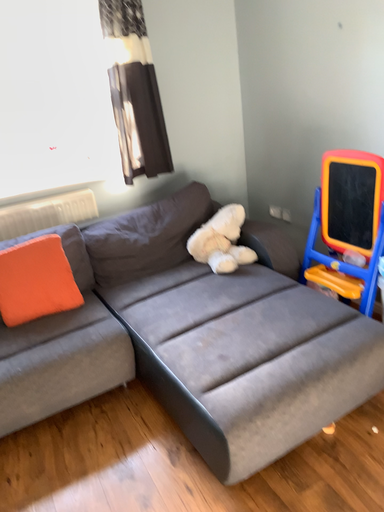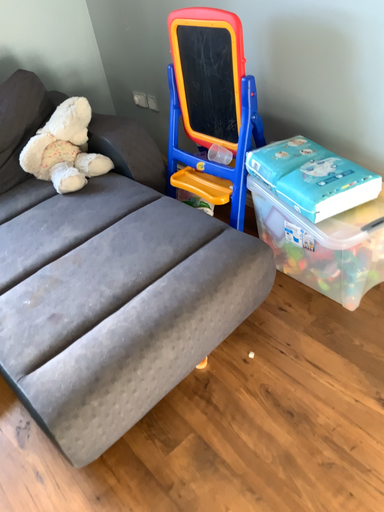
Question: How did the camera likely rotate when shooting the video?

Choices:
 (A) rotated upward
 (B) rotated downward

Answer: (B)